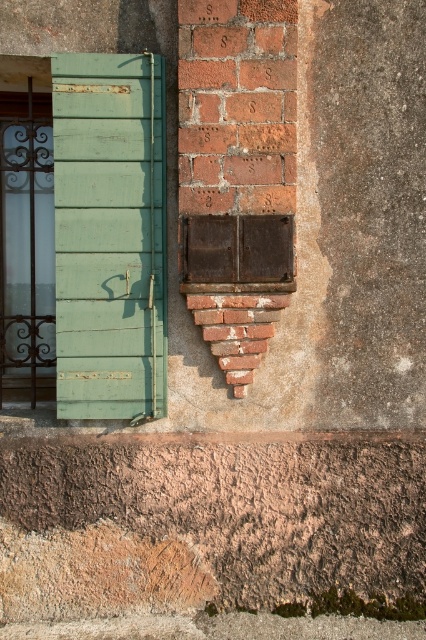
Is green painted wood at left to the right of rusty metal window at center from the viewer's perspective?

In fact, green painted wood at left is to the left of rusty metal window at center.

Between green painted wood at left and rusty metal window at center, which one is positioned higher?

green painted wood at left

The image size is (426, 640). Identify the location of green painted wood at left. (109, 236).

Find the location of a particular element. green painted wood at left is located at coordinates (109, 236).